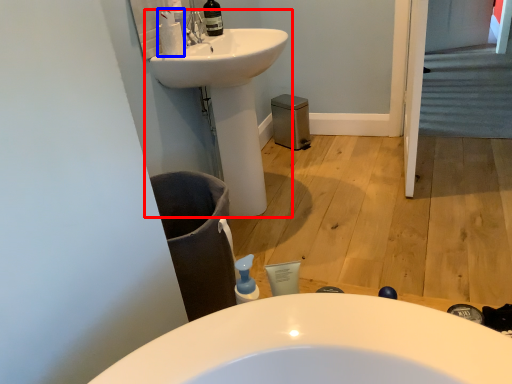
Question: Which object is closer to the camera taking this photo, sink (highlighted by a red box) or cleaning product (highlighted by a blue box)?

Choices:
 (A) sink
 (B) cleaning product

Answer: (A)